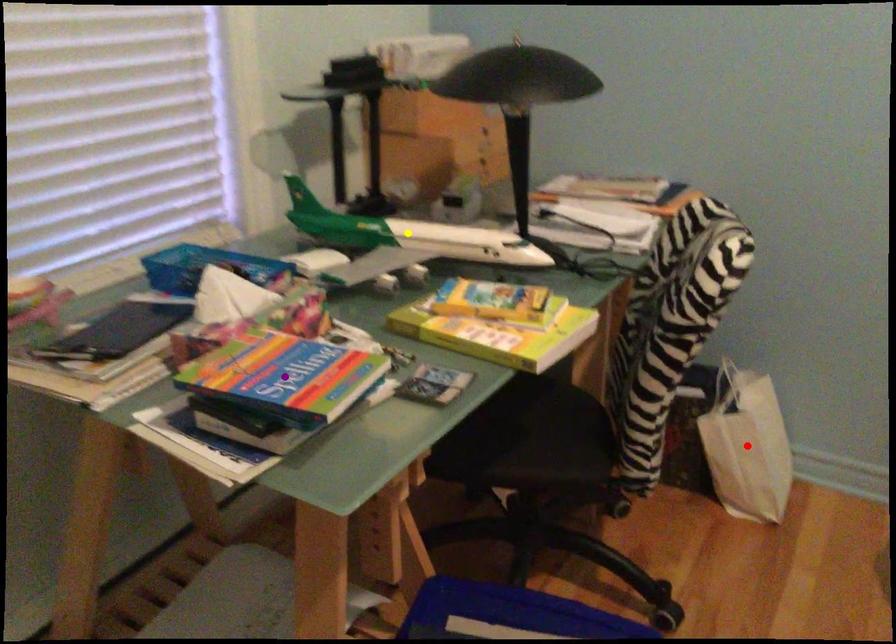
Order these from farthest to nearest:
purple point, red point, yellow point

red point
yellow point
purple point